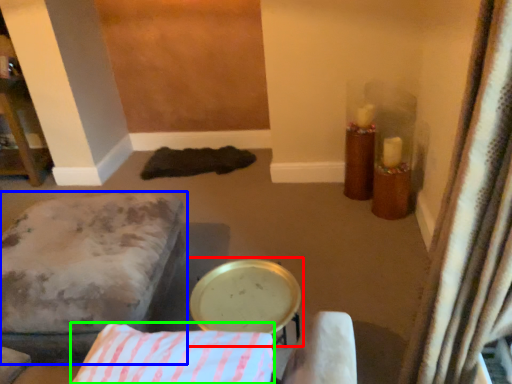
Question: Which object is positioned closest to round table (highlighted by a red box)? Select from furniture (highlighted by a blue box) and pillow (highlighted by a green box).

Choices:
 (A) furniture
 (B) pillow

Answer: (B)